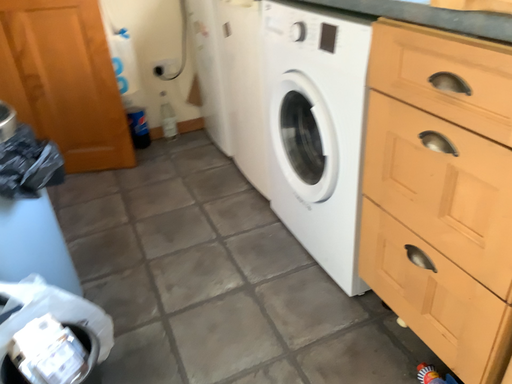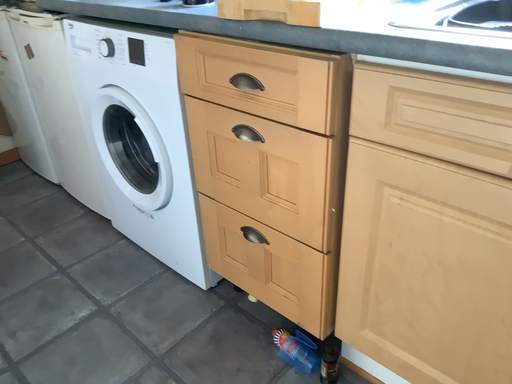
Question: Which way did the camera rotate in the video?

Choices:
 (A) rotated right
 (B) rotated left

Answer: (A)